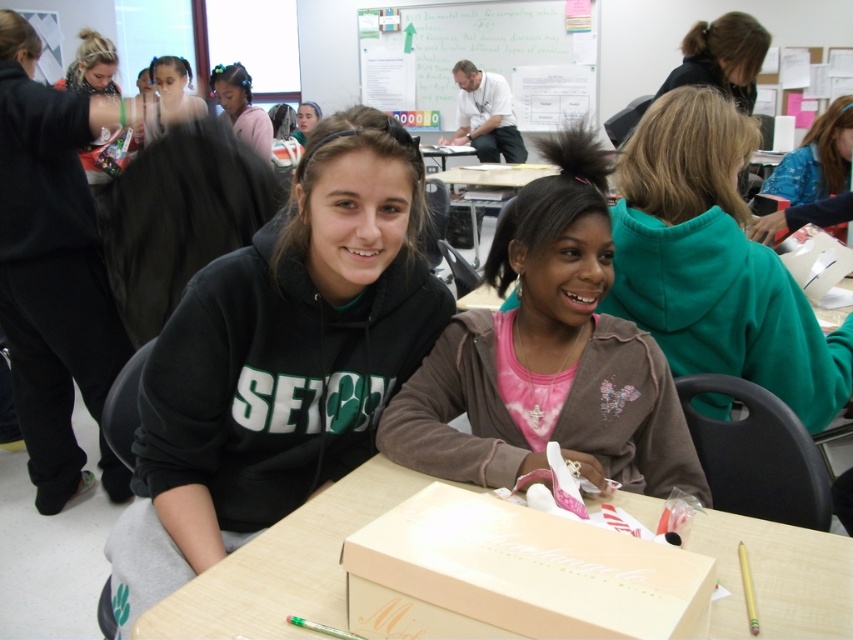
Question: Which object is the closest to the whiteboard at upper center?

Choices:
 (A) black hoodie at upper left
 (B) dark brown hair at upper right

Answer: (B)

Question: Is wooden table at center to the right of pink fabric headband at upper left from the viewer's perspective?

Choices:
 (A) no
 (B) yes

Answer: (B)

Question: Among these points, which one is farthest from the camera?

Choices:
 (A) (238, 120)
 (B) (677, 365)

Answer: (A)

Question: From the image, what is the correct spatial relationship of matte pink cardboard box at center in relation to green hoodie at upper right?

Choices:
 (A) right
 (B) left

Answer: (B)

Question: Does black matte hoodie at center have a lesser width compared to brown fleece jacket at center?

Choices:
 (A) no
 (B) yes

Answer: (A)

Question: Based on their relative distances, which object is farther from the green hoodie at upper right?

Choices:
 (A) brown fleece jacket at center
 (B) dark brown hair at upper right
 (C) black hoodie at upper left

Answer: (C)